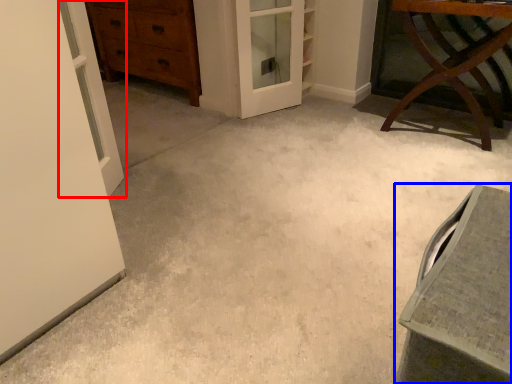
Question: Which object appears closest to the camera in this image, door (highlighted by a red box) or vanity (highlighted by a blue box)?

Choices:
 (A) door
 (B) vanity

Answer: (B)